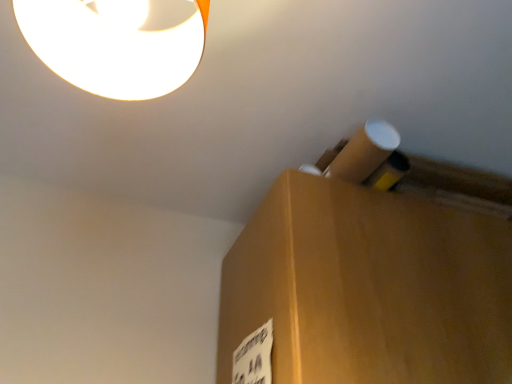
Measure the distance between white glossy lampshade at upper left and camera.

The depth of white glossy lampshade at upper left is 24.15 inches.

Locate an element on the screen. The height and width of the screenshot is (384, 512). white glossy lampshade at upper left is located at coordinates [111, 49].

What do you see at coordinates (111, 49) in the screenshot? This screenshot has height=384, width=512. I see `white glossy lampshade at upper left` at bounding box center [111, 49].

I want to click on white glossy lampshade at upper left, so click(x=111, y=49).